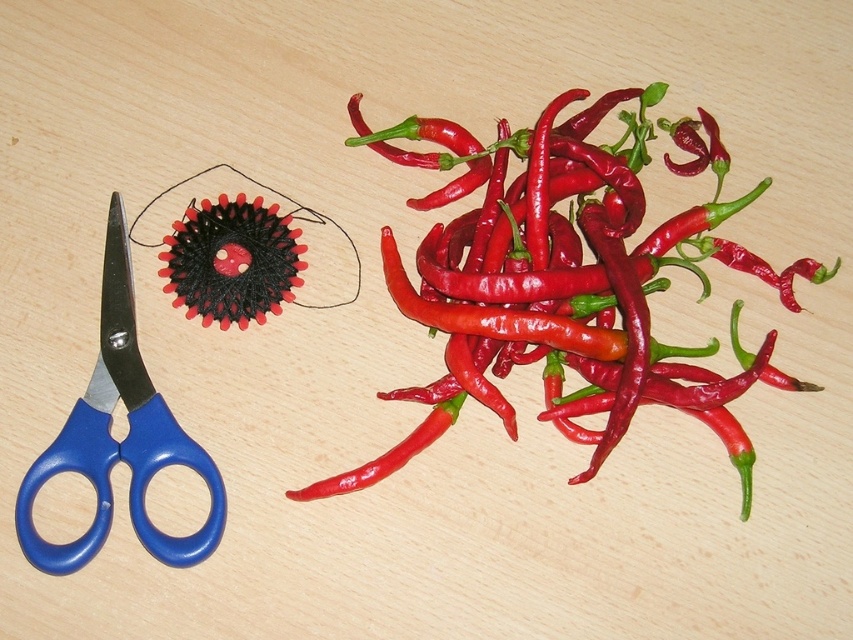
Question: Can you confirm if smooth red chili peppers at upper right is wider than blue plastic scissors at left?

Choices:
 (A) yes
 (B) no

Answer: (A)

Question: Is smooth red chili peppers at upper right bigger than blue plastic scissors at left?

Choices:
 (A) no
 (B) yes

Answer: (B)

Question: Is smooth red chili peppers at upper right positioned before blue plastic scissors at left?

Choices:
 (A) no
 (B) yes

Answer: (A)

Question: Which point is farther from the camera taking this photo?

Choices:
 (A) (456, 365)
 (B) (161, 397)

Answer: (A)

Question: Which object appears closest to the camera in this image?

Choices:
 (A) blue plastic scissors at left
 (B) smooth red chili peppers at upper right

Answer: (A)